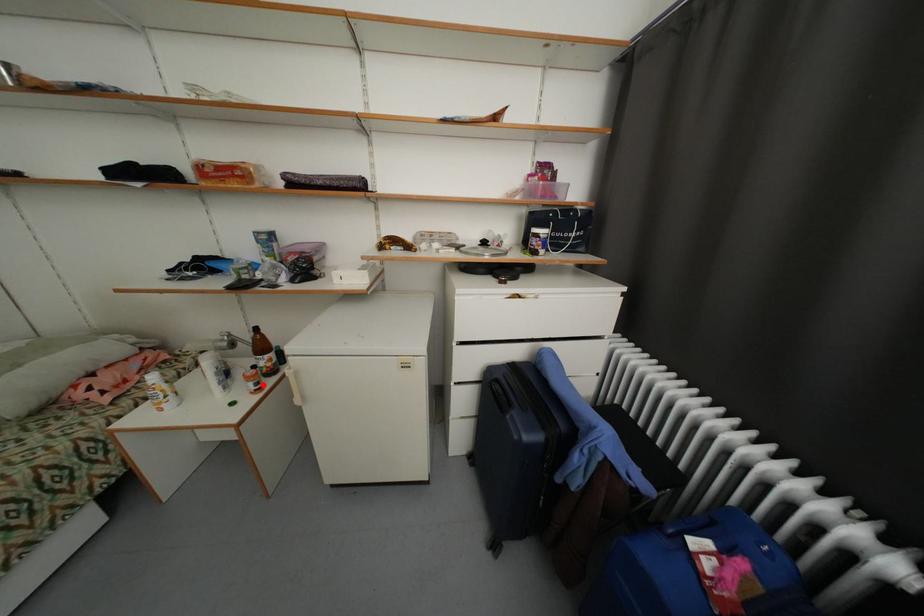
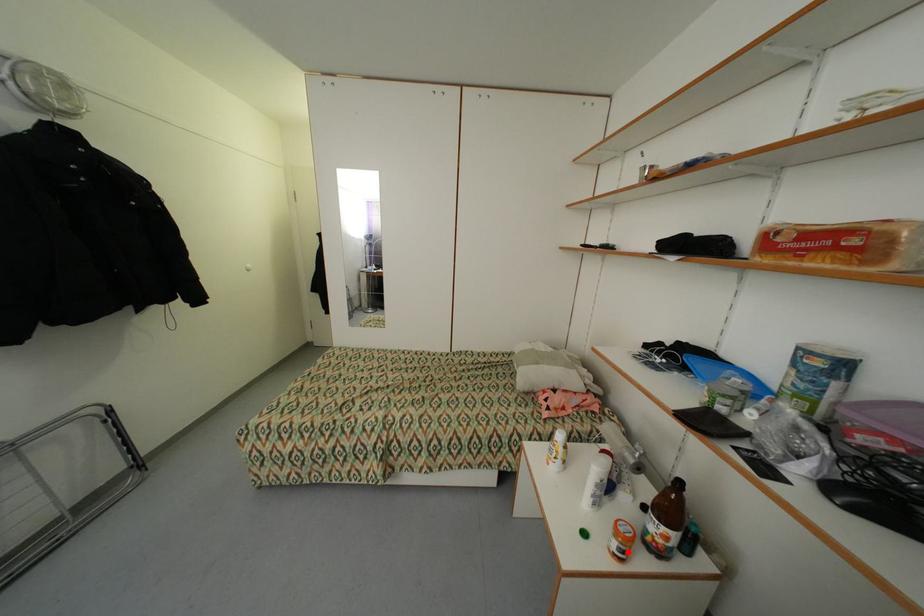
I am providing you with two images of the same scene from different viewpoints. A red point is marked on the first image and another point is marked on the second image. Is the marked point in image1 the same physical position as the marked point in image2?

Yes